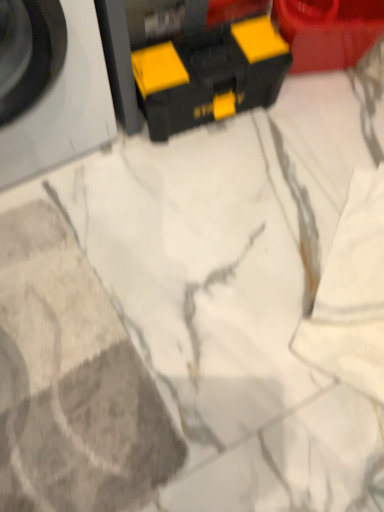
Question: Is black plastic toolbox at upper center far away from white matte washing machine at left?

Choices:
 (A) no
 (B) yes

Answer: (A)

Question: Can you confirm if black plastic toolbox at upper center is wider than white matte washing machine at left?

Choices:
 (A) no
 (B) yes

Answer: (A)

Question: Can you confirm if black plastic toolbox at upper center is positioned to the left of white matte washing machine at left?

Choices:
 (A) no
 (B) yes

Answer: (A)

Question: From the image's perspective, is black plastic toolbox at upper center under white matte washing machine at left?

Choices:
 (A) no
 (B) yes

Answer: (B)

Question: Is black plastic toolbox at upper center facing away from white matte washing machine at left?

Choices:
 (A) no
 (B) yes

Answer: (A)

Question: Is white matte washing machine at left surrounded by black plastic toolbox at upper center?

Choices:
 (A) yes
 (B) no

Answer: (B)

Question: Is white matte washing machine at left bigger than black plastic toolbox at upper center?

Choices:
 (A) no
 (B) yes

Answer: (B)

Question: Does white matte washing machine at left come in front of black plastic toolbox at upper center?

Choices:
 (A) no
 (B) yes

Answer: (B)

Question: Does white matte washing machine at left have a greater width compared to black plastic toolbox at upper center?

Choices:
 (A) yes
 (B) no

Answer: (A)

Question: Is black plastic toolbox at upper center inside white matte washing machine at left?

Choices:
 (A) no
 (B) yes

Answer: (A)

Question: Is white matte washing machine at left positioned with its back to black plastic toolbox at upper center?

Choices:
 (A) yes
 (B) no

Answer: (B)

Question: Can we say white matte washing machine at left lies outside black plastic toolbox at upper center?

Choices:
 (A) no
 (B) yes

Answer: (B)

Question: Is white matte washing machine at left taller or shorter than black plastic toolbox at upper center?

Choices:
 (A) tall
 (B) short

Answer: (A)